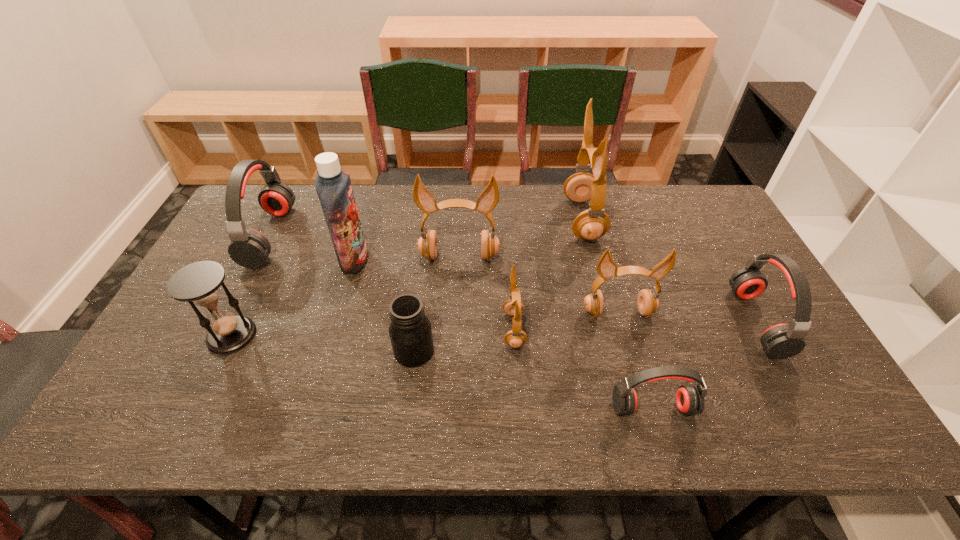
The height and width of the screenshot is (540, 960). In order to click on vacant space located 0.080m on the ear cups of the leftmost red earphone in this screenshot , I will do `click(311, 236)`.

This screenshot has width=960, height=540. Identify the location of free spot located on the front-facing side of the third biggest brown earphone. (638, 385).

Where is `vacant space situated 0.070m on the right of the hourglass`? vacant space situated 0.070m on the right of the hourglass is located at coordinates (282, 335).

This screenshot has width=960, height=540. I want to click on vacant point located 0.050m on the ear cups of the rightmost earphone, so click(x=722, y=321).

Locate an element on the screen. The image size is (960, 540). vacant space located on the ear cups of the rightmost earphone is located at coordinates (661, 321).

At what (x,y) coordinates should I click in order to perform the action: click on vacant space located 0.350m on the ear cups of the rightmost earphone. Please return your answer as a coordinate pair (x, y). The height and width of the screenshot is (540, 960). Looking at the image, I should click on (609, 321).

You are a GUI agent. You are given a task and a screenshot of the screen. Output one action in this format:
    pyautogui.click(x=<x>, y=<y>)
    Task: Click on the vacant point located on the front-facing side of the smallest brown earphone
    
    Given the screenshot: What is the action you would take?
    pyautogui.click(x=476, y=329)

Locate an element on the screen. The image size is (960, 540). free location located on the front-facing side of the smallest brown earphone is located at coordinates (480, 329).

Image resolution: width=960 pixels, height=540 pixels. I want to click on vacant space located 0.140m on the front-facing side of the smallest brown earphone, so click(x=448, y=329).

At what (x,y) coordinates should I click in order to perform the action: click on vacant space located 0.240m on the back of the jar. Please return your answer as a coordinate pair (x, y). The image size is (960, 540). Looking at the image, I should click on (424, 269).